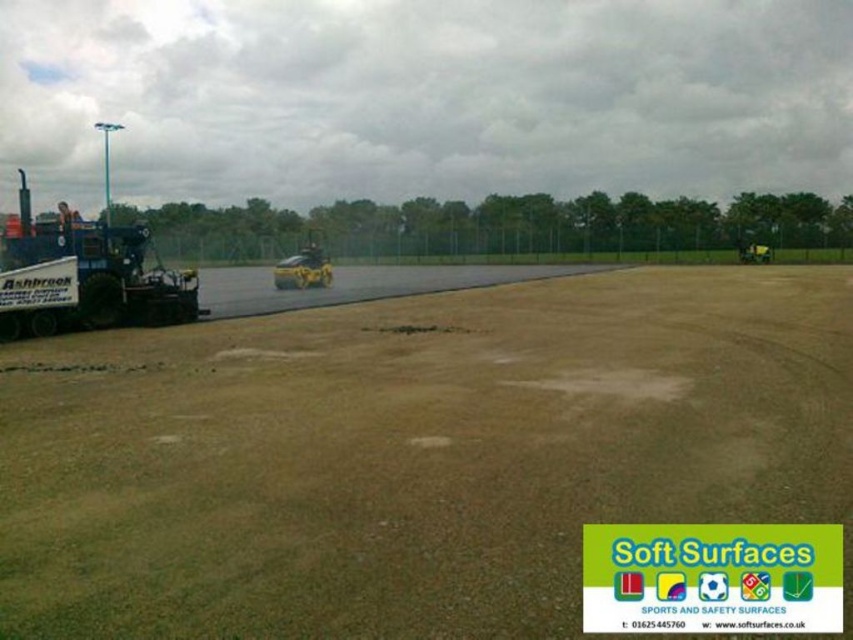
You are a delivery driver who needs to park your blue metallic trailer truck at left and yellow rubber car at center in this outdoor area. According to the scene, where should you place each vehicle to avoid blocking the construction equipment? Please state the correct positions based on their current locations.

The blue metallic trailer truck at left is positioned on the left side of the yellow rubber car at center. To avoid blocking the construction equipment, the blue metallic trailer truck at left should remain on the left side of the yellow rubber car at center, ensuring they are parked in a way that doesn

You are a construction worker standing at the edge of the brown sandy dirt field at center. You need to move a heavy equipment part from the blue metallic trailer truck at left to the field. Which direction should you move the part to place it onto the field?

The brown sandy dirt field at center is below the blue metallic trailer truck at left, so you should move the heavy equipment part downward from the blue metallic trailer truck at left to place it onto the brown sandy dirt field at center.

You are a delivery driver who needs to park your truck, which is the blue metallic trailer truck at left, near the brown sandy dirt field at center. Based on the scene, can you park the truck directly behind the field without blocking the machinery?

The brown sandy dirt field at center is in front of the blue metallic trailer truck at left, meaning the truck is already positioned behind the field. Since the machinery is near the edge of the field, parking the truck in its current position would not block the machinery.